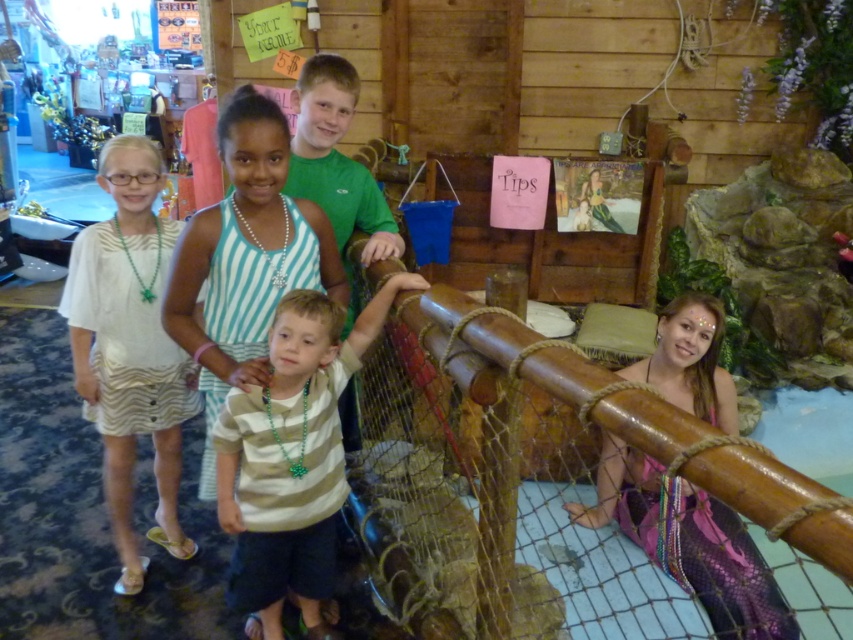
You are a photographer trying to capture the entire wooden structure at upper center in your shot. You notice a point marked at coordinates (x=508, y=484). Where is this point located in relation to the wooden structure?

The point at (x=508, y=484) corresponds to the wooden structure at upper center, so it is located exactly on the wooden structure.

In the scene shown: You are a photographer trying to capture a clear shot of the striped cotton shirt at center without the wooden at upper center blocking it. Based on the scene description, what adjustment should you make to your camera angle?

The wooden at upper center is in front of the striped cotton shirt at center, so you should lower your camera angle to position it below the wooden structure for an unobstructed view of the striped cotton shirt at center.